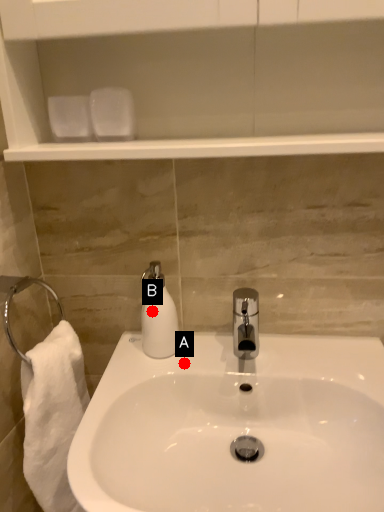
Question: Two points are circled on the image, labeled by A and B beside each circle. Which point appears farthest from the camera in this image?

Choices:
 (A) A is further
 (B) B is further

Answer: (A)